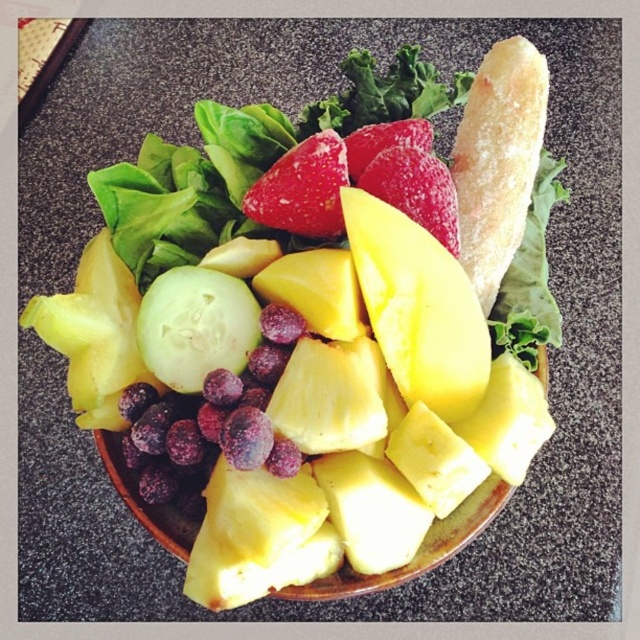
Does golden crusty bread at upper right appear under shiny red strawberry at center?

Actually, golden crusty bread at upper right is above shiny red strawberry at center.

Is golden crusty bread at upper right thinner than shiny red strawberry at center?

Yes, golden crusty bread at upper right is thinner than shiny red strawberry at center.

Which is in front, point (516, 122) or point (284, 180)?

Point (284, 180)

Where is `golden crusty bread at upper right`? The image size is (640, 640). golden crusty bread at upper right is located at coordinates (499, 160).

Describe the element at coordinates (417, 307) in the screenshot. This screenshot has height=640, width=640. I see `yellow juicy pineapple at center` at that location.

This screenshot has height=640, width=640. Identify the location of yellow juicy pineapple at center. (417, 307).

Find the location of `yellow juicy pineapple at center`. yellow juicy pineapple at center is located at coordinates (417, 307).

Identify the location of yellow juicy pineapple at center. (417, 307).

Looking at this image, who is positioned more to the right, yellow juicy pineapple at center or shiny red strawberry at center?

Positioned to the right is yellow juicy pineapple at center.

I want to click on yellow juicy pineapple at center, so click(x=417, y=307).

The width and height of the screenshot is (640, 640). What do you see at coordinates (417, 307) in the screenshot?
I see `yellow juicy pineapple at center` at bounding box center [417, 307].

Find the location of a particular element. This screenshot has height=640, width=640. yellow juicy pineapple at center is located at coordinates pyautogui.click(x=417, y=307).